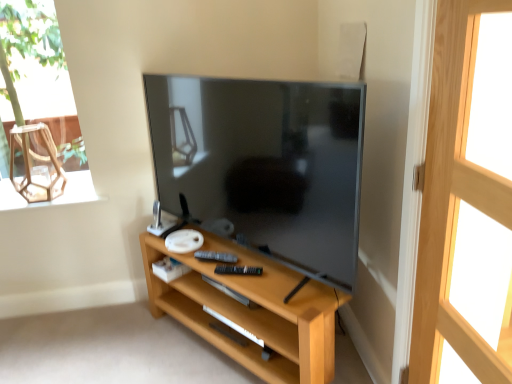
Question: Can you confirm if matte black tv at center is shorter than light wood shelf at center?

Choices:
 (A) no
 (B) yes

Answer: (A)

Question: Considering the relative sizes of matte black tv at center and light wood shelf at center in the image provided, is matte black tv at center taller than light wood shelf at center?

Choices:
 (A) yes
 (B) no

Answer: (A)

Question: Could you tell me if matte black tv at center is turned towards light wood shelf at center?

Choices:
 (A) no
 (B) yes

Answer: (A)

Question: From the image's perspective, is matte black tv at center above light wood shelf at center?

Choices:
 (A) no
 (B) yes

Answer: (B)

Question: Is matte black tv at center positioned with its back to light wood shelf at center?

Choices:
 (A) yes
 (B) no

Answer: (B)

Question: Is matte black tv at center to the left of light wood shelf at center from the viewer's perspective?

Choices:
 (A) no
 (B) yes

Answer: (B)

Question: From a real-world perspective, is light wood screen door at right positioned over transparent glass armchair at upper left based on gravity?

Choices:
 (A) no
 (B) yes

Answer: (A)

Question: Is light wood screen door at right bigger than transparent glass armchair at upper left?

Choices:
 (A) yes
 (B) no

Answer: (A)

Question: From a real-world perspective, is light wood screen door at right physically below transparent glass armchair at upper left?

Choices:
 (A) no
 (B) yes

Answer: (B)

Question: Considering the relative sizes of light wood screen door at right and transparent glass armchair at upper left in the image provided, is light wood screen door at right taller than transparent glass armchair at upper left?

Choices:
 (A) no
 (B) yes

Answer: (B)

Question: From the image's perspective, is light wood screen door at right under transparent glass armchair at upper left?

Choices:
 (A) no
 (B) yes

Answer: (B)

Question: Is light wood screen door at right not within transparent glass armchair at upper left?

Choices:
 (A) yes
 (B) no

Answer: (A)

Question: Is light wood shelf at center oriented towards black plastic remote at center?

Choices:
 (A) yes
 (B) no

Answer: (B)